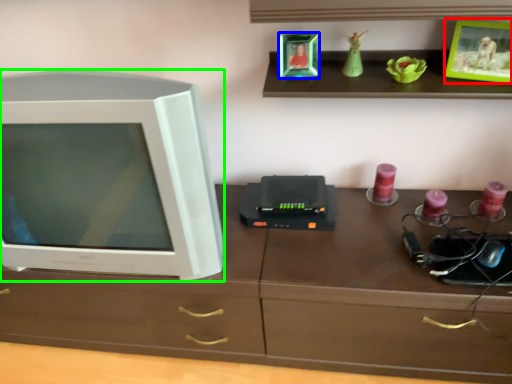
Question: Based on their relative distances, which object is nearer to picture frame (highlighted by a red box)? Choose from picture frame (highlighted by a blue box) and television (highlighted by a green box).

Choices:
 (A) picture frame
 (B) television

Answer: (A)